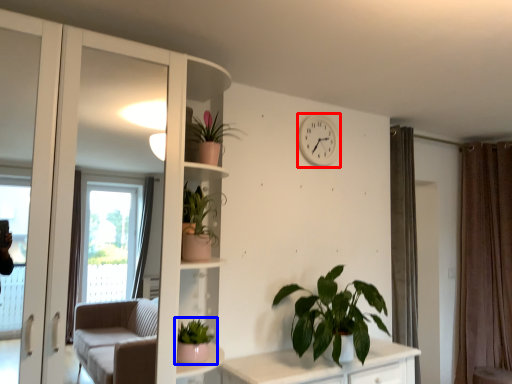
Question: Which object appears closest to the camera in this image, clock (highlighted by a red box) or houseplant (highlighted by a blue box)?

Choices:
 (A) clock
 (B) houseplant

Answer: (B)